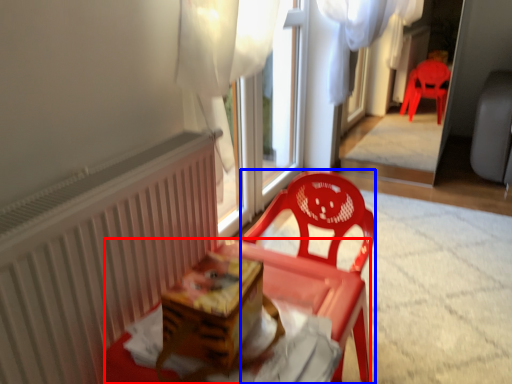
Question: Which point is closer to the camera, table (highlighted by a red box) or chair (highlighted by a blue box)?

Choices:
 (A) table
 (B) chair

Answer: (A)